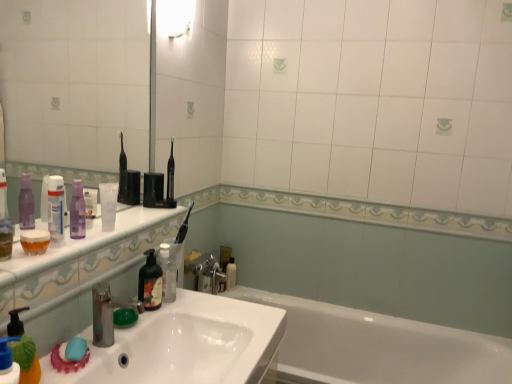
Identify the location of unoccupied space behind teal matte soap at sink. The width and height of the screenshot is (512, 384). (97, 338).